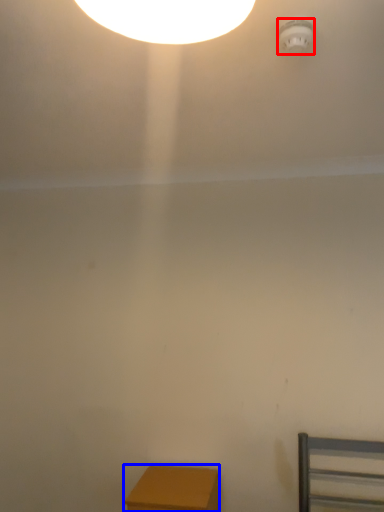
Question: Among these objects, which one is farthest to the camera, lamp (highlighted by a red box) or furniture (highlighted by a blue box)?

Choices:
 (A) lamp
 (B) furniture

Answer: (B)